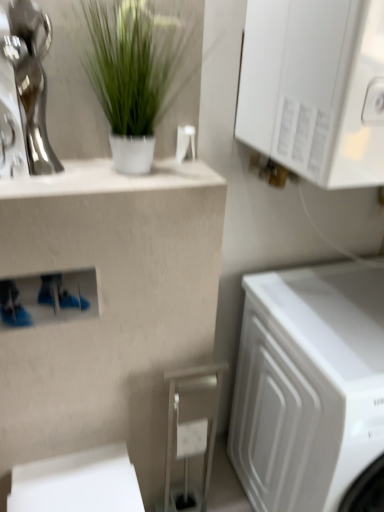
Where is `vacant area situated below green matte plant at upper center (from a real-world perspective)`? vacant area situated below green matte plant at upper center (from a real-world perspective) is located at coordinates (135, 172).